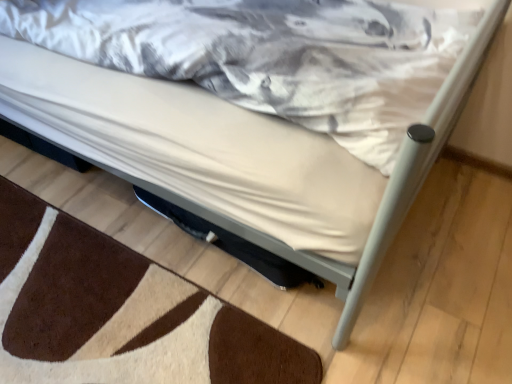
Locate an element on the screen. free space above brown shaggy rug at lower left (from a real-world perspective) is located at coordinates (93, 302).